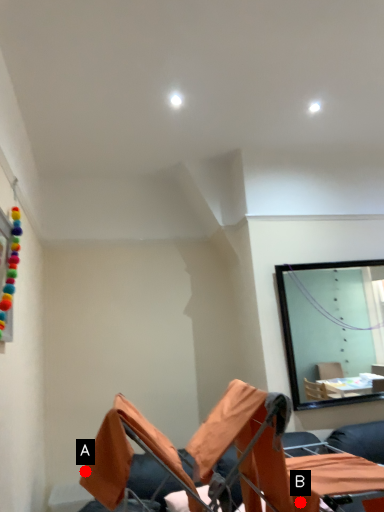
Question: Two points are circled on the image, labeled by A and B beside each circle. Which point appears farthest from the camera in this image?

Choices:
 (A) A is further
 (B) B is further

Answer: (B)